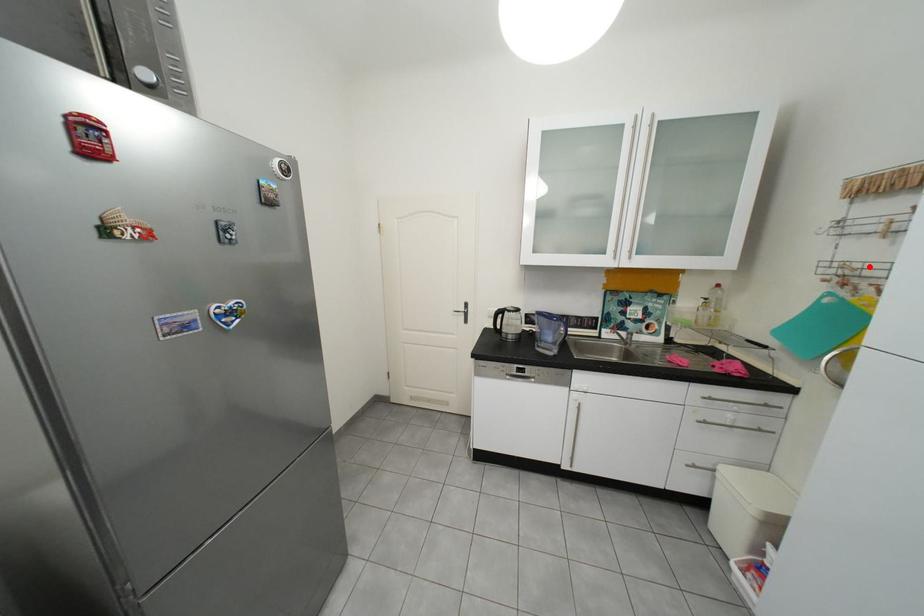
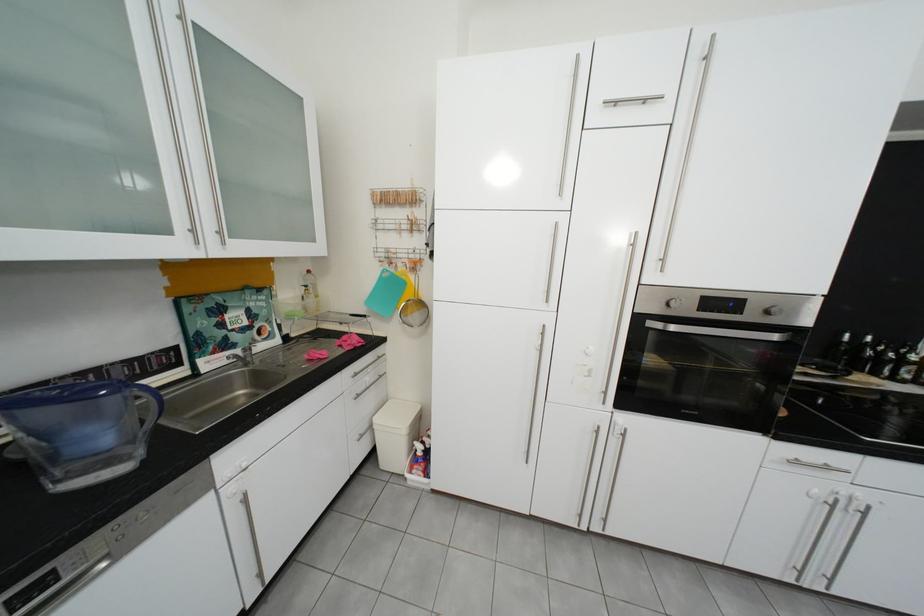
Find the pixel in the second image that matches the highlighted location in the first image.

(406, 252)